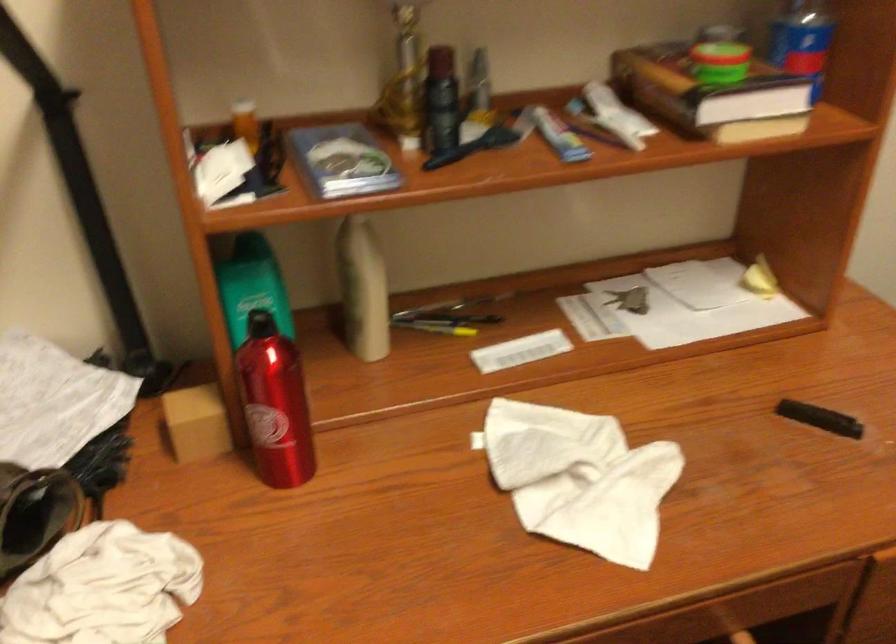
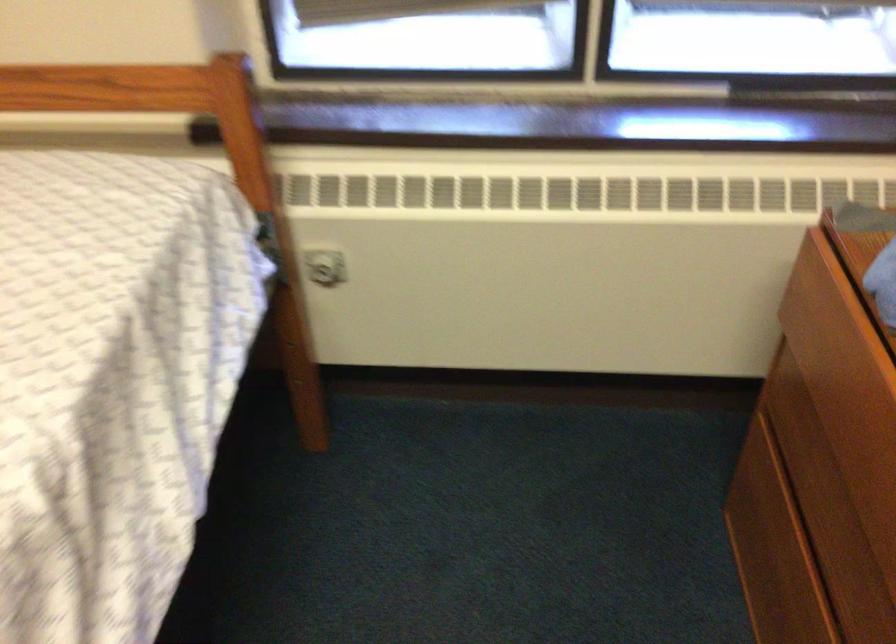
Based on the continuous images, in which direction is the camera rotating?

The camera's rotation is toward left-down.